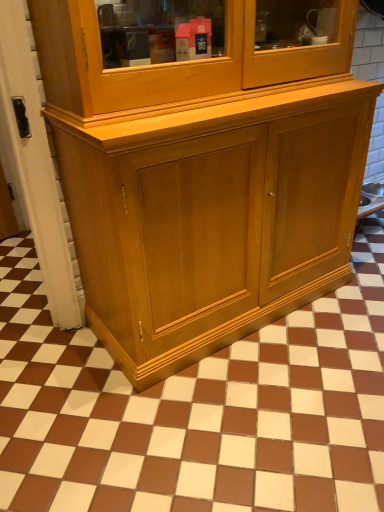
Describe the element at coordinates (196, 409) in the screenshot. This screenshot has height=512, width=384. I see `brown glossy tile at center` at that location.

At what (x,y) coordinates should I click in order to perform the action: click on brown glossy tile at center. Please return your answer as a coordinate pair (x, y). This screenshot has width=384, height=512. Looking at the image, I should click on (196, 409).

Image resolution: width=384 pixels, height=512 pixels. I want to click on brown glossy tile at center, so click(x=196, y=409).